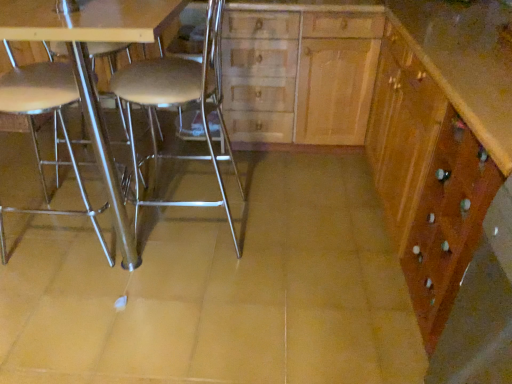
Question: Is metallic silver table at center outside wooden cabinet at right?

Choices:
 (A) no
 (B) yes

Answer: (B)

Question: Considering the relative sizes of metallic silver table at center and wooden cabinet at right in the image provided, is metallic silver table at center shorter than wooden cabinet at right?

Choices:
 (A) no
 (B) yes

Answer: (A)

Question: From the image's perspective, does metallic silver table at center appear higher than wooden cabinet at right?

Choices:
 (A) yes
 (B) no

Answer: (A)

Question: Does metallic silver table at center have a greater width compared to wooden cabinet at right?

Choices:
 (A) no
 (B) yes

Answer: (B)

Question: Does metallic silver table at center lie behind wooden cabinet at right?

Choices:
 (A) yes
 (B) no

Answer: (A)

Question: From a real-world perspective, is metallic silver table at center physically below wooden cabinet at right?

Choices:
 (A) no
 (B) yes

Answer: (A)

Question: Is wooden cabinet at right smaller than metallic silver stool at center, placed as the 2th chair when sorted from left to right?

Choices:
 (A) yes
 (B) no

Answer: (B)

Question: Is wooden cabinet at right aimed at metallic silver stool at center, placed as the 2th chair when sorted from left to right?

Choices:
 (A) no
 (B) yes

Answer: (B)

Question: Does wooden cabinet at right appear on the left side of metallic silver stool at center, the first chair from the right?

Choices:
 (A) no
 (B) yes

Answer: (A)

Question: Is wooden cabinet at right turned away from metallic silver stool at center, the first chair from the right?

Choices:
 (A) yes
 (B) no

Answer: (B)

Question: Would you say wooden cabinet at right is a long distance from metallic silver stool at center, the first chair from the right?

Choices:
 (A) yes
 (B) no

Answer: (B)

Question: Does wooden cabinet at right have a lesser width compared to metallic silver stool at center, the first chair from the right?

Choices:
 (A) yes
 (B) no

Answer: (B)

Question: Considering the relative sizes of metallic silver chair at left, arranged as the second chair when viewed from the right, and metallic silver stool at center, placed as the 2th chair when sorted from left to right, in the image provided, is metallic silver chair at left, arranged as the second chair when viewed from the right, bigger than metallic silver stool at center, placed as the 2th chair when sorted from left to right,?

Choices:
 (A) no
 (B) yes

Answer: (A)